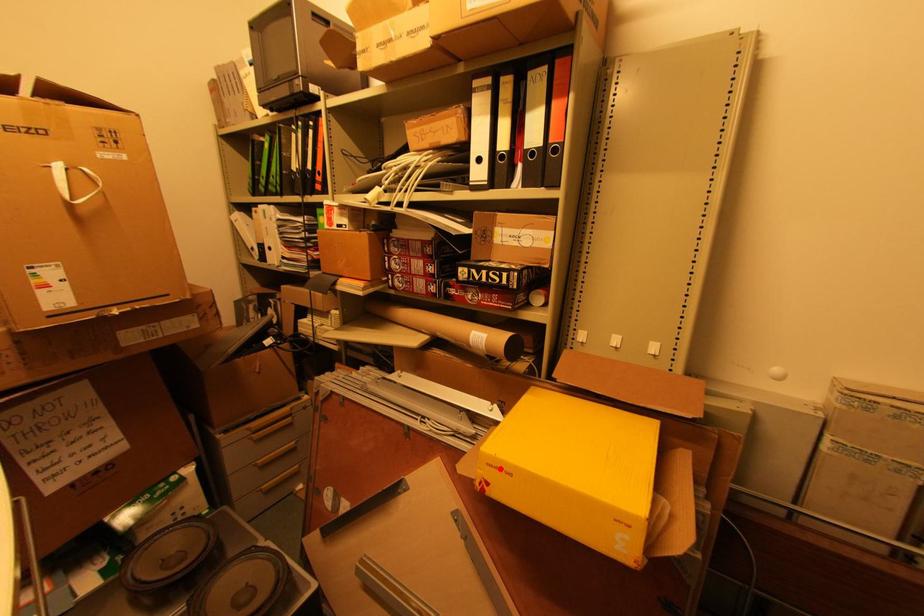
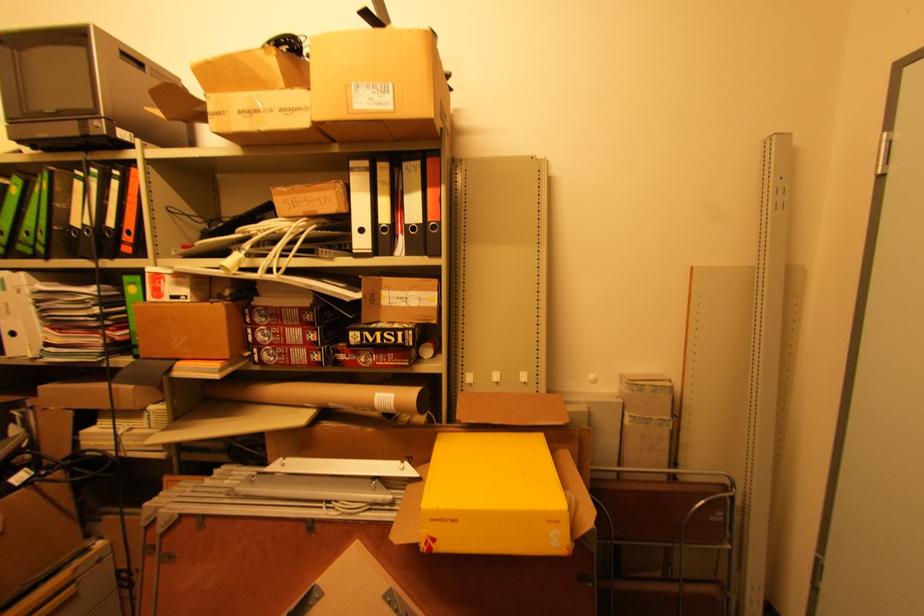
Question: I am providing you with two images of the same scene from different viewpoints. Image1 has a red point marked. In image2, the corresponding 3D location appears at what relative position? Reply with the corresponding letter.

Choices:
 (A) Closer
 (B) Farther

Answer: (B)